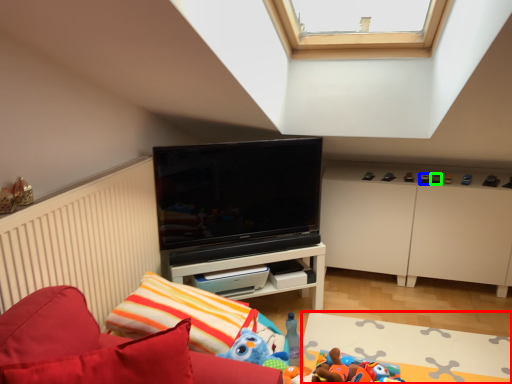
Question: Which object is the closest to the plain (highlighted by a red box)? Choose among these: toy (highlighted by a blue box) or toy (highlighted by a green box).

Choices:
 (A) toy
 (B) toy

Answer: (A)